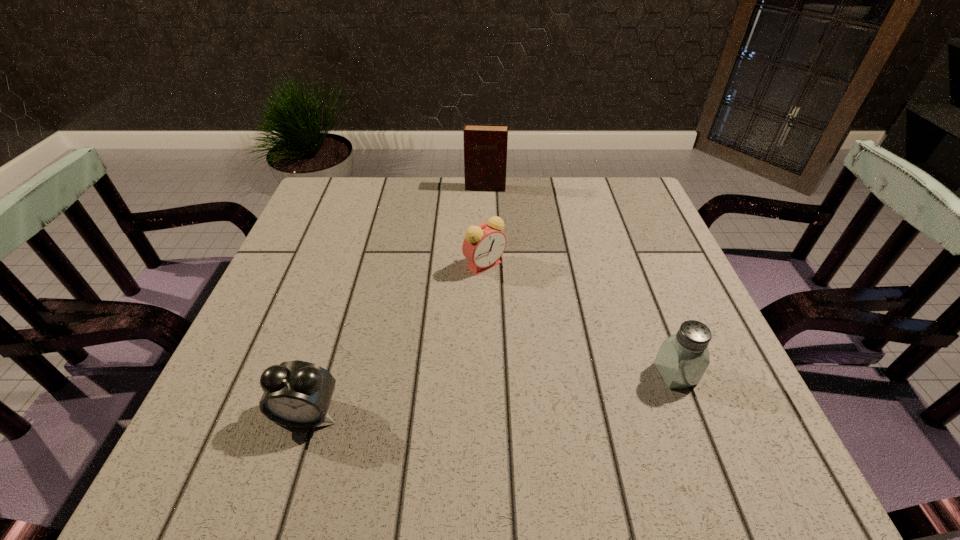
At what (x,y) coordinates should I click in order to perform the action: click on object at the near left corner. Please return your answer as a coordinate pair (x, y). The image size is (960, 540). Looking at the image, I should click on (297, 394).

This screenshot has width=960, height=540. In order to click on object that is at the near right corner in this screenshot , I will do `click(683, 358)`.

Where is `free location at the far edge of the desktop`? free location at the far edge of the desktop is located at coordinates (391, 177).

The image size is (960, 540). In order to click on vacant space at the near edge in this screenshot , I will do `click(395, 378)`.

This screenshot has width=960, height=540. In order to click on free space at the left edge of the desktop in this screenshot , I will do `click(342, 258)`.

In the image, there is a desktop. Where is `vacant space at the right edge`? The width and height of the screenshot is (960, 540). vacant space at the right edge is located at coordinates (644, 326).

This screenshot has width=960, height=540. I want to click on vacant space at the far left corner of the desktop, so click(316, 204).

In order to click on vacant space in between the tallest object and the rightmost object in this screenshot , I will do `click(580, 281)`.

Find the location of `free point between the diary and the saltshaker`. free point between the diary and the saltshaker is located at coordinates (580, 281).

The height and width of the screenshot is (540, 960). Find the location of `free space that is in between the farther alarm clock and the nearest object`. free space that is in between the farther alarm clock and the nearest object is located at coordinates (396, 339).